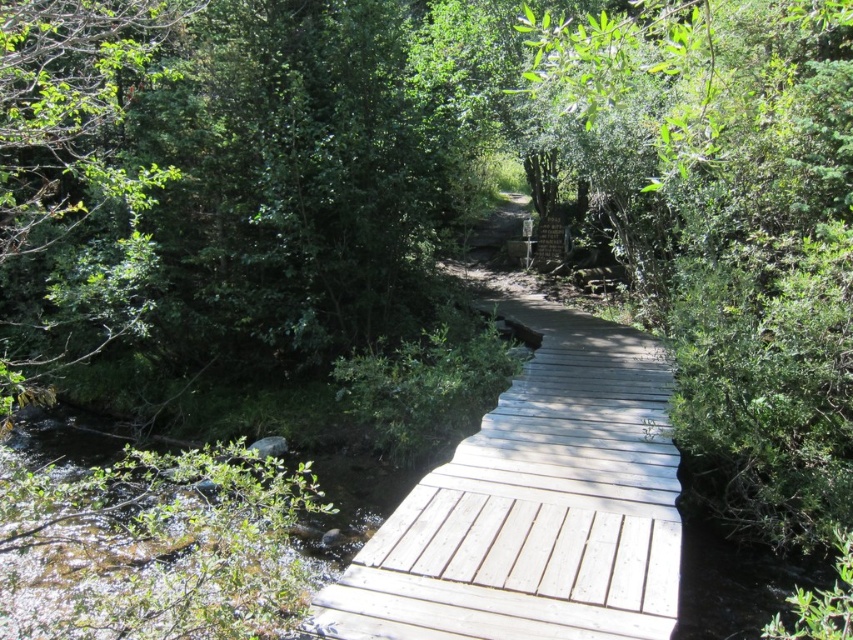
You are standing on the boardwalk and want to cross the water using the light gray wooden bridge at center. However, there is a green leafy tree at left blocking your path. Which direction should you walk to reach the bridge without going near the tree?

Result: You should walk to the right of the green leafy tree at left because the light gray wooden bridge at center is located to the right of the tree, so moving in that direction will allow you to reach the bridge while avoiding the tree.

You are a hiker carrying a 6.5 feet long backpack. You see the light gray wooden bridge at center and the green leafy tree at left. Can you pass through the space between them without tilting your backpack?

The light gray wooden bridge at center and green leafy tree at left are 6.58 feet apart from each other. Since your backpack is 6.5 feet long, it should fit through the space between them without needing to tilt, as the distance is slightly larger than the backpack length.

You are a hiker carrying a large backpack and need to cross the light gray wooden bridge at center. There is a green leafy tree at left nearby. Can you determine if the bridge is wide enough to safely walk across while avoiding the tree?

The light gray wooden bridge at center might be wider than green leafy tree at left, so it is possible that the bridge is wide enough to safely walk across while avoiding the tree. However, the exact width is uncertain based on the available information.